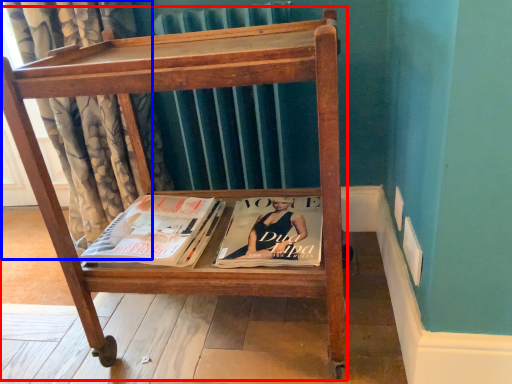
Question: Among these objects, which one is farthest to the camera, furniture (highlighted by a red box) or curtain (highlighted by a blue box)?

Choices:
 (A) furniture
 (B) curtain

Answer: (B)